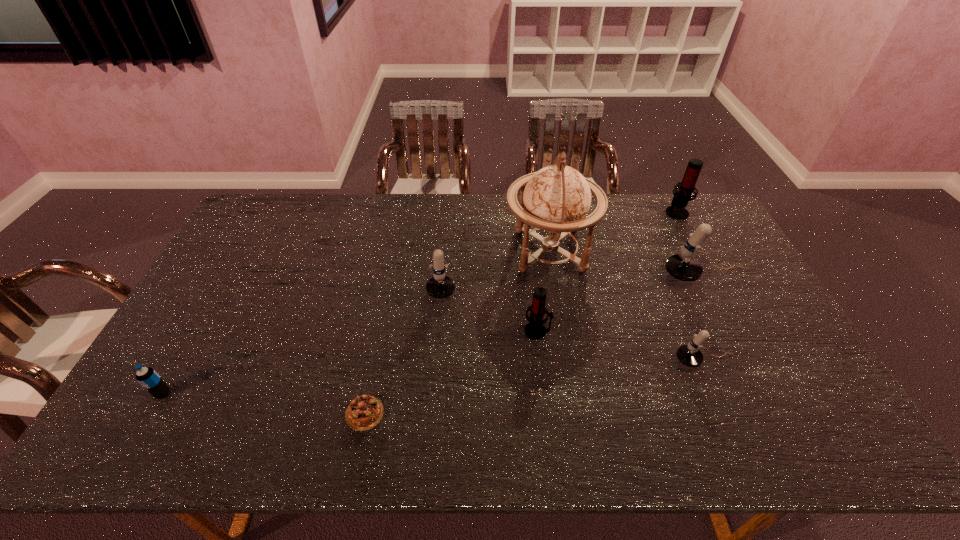
Identify the location of free space at the left edge of the desktop. (199, 371).

Identify the location of vacant region at the right edge. (762, 344).

The width and height of the screenshot is (960, 540). In the image, there is a desktop. Identify the location of vacant space at the near left corner. (159, 453).

Locate an element on the screen. The width and height of the screenshot is (960, 540). free space between the leftmost white microphone and the globe is located at coordinates (496, 264).

Where is `vacant area between the biggest white microphone and the second biggest white microphone`? vacant area between the biggest white microphone and the second biggest white microphone is located at coordinates (574, 277).

Image resolution: width=960 pixels, height=540 pixels. I want to click on empty location between the second object from left to right and the nearest white microphone, so click(x=535, y=387).

Where is `free space between the second smallest white microphone and the tallest object`? free space between the second smallest white microphone and the tallest object is located at coordinates (496, 264).

Find the location of `free area in between the shortest object and the biggest white microphone`. free area in between the shortest object and the biggest white microphone is located at coordinates (535, 345).

The image size is (960, 540). I want to click on empty space that is in between the sixth object from right to left and the shortest object, so click(403, 346).

Identify the location of vacant region between the leftmost object and the chocolate cake. The image size is (960, 540). (264, 403).